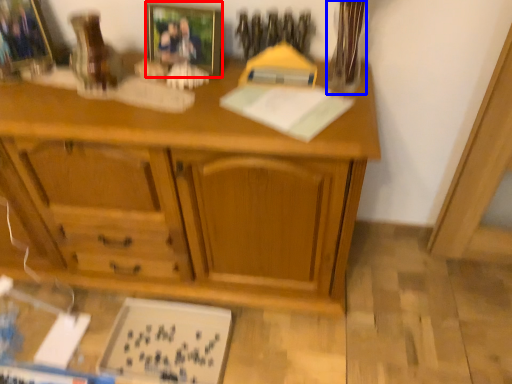
Question: Which object is closer to the camera taking this photo, picture frame (highlighted by a red box) or glass vase (highlighted by a blue box)?

Choices:
 (A) picture frame
 (B) glass vase

Answer: (B)